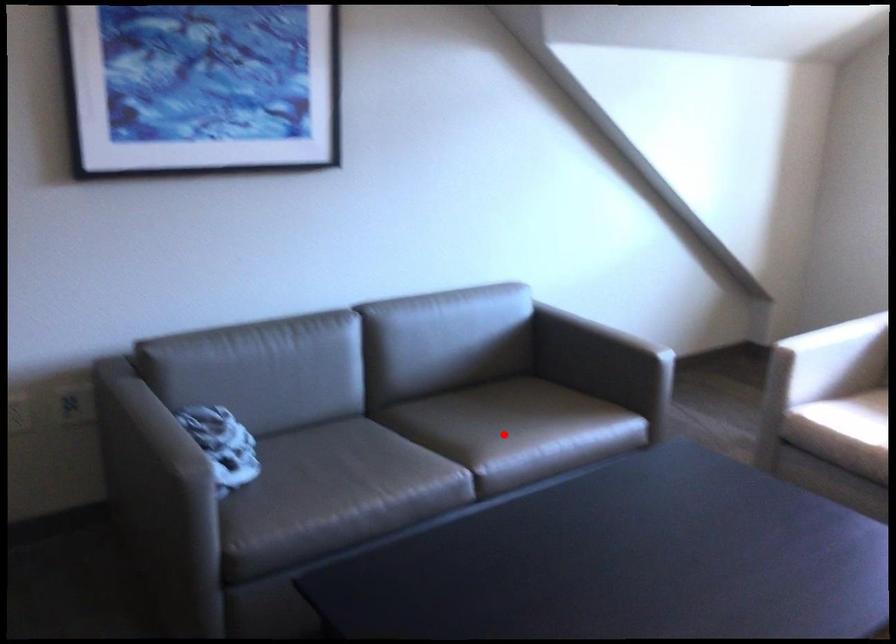
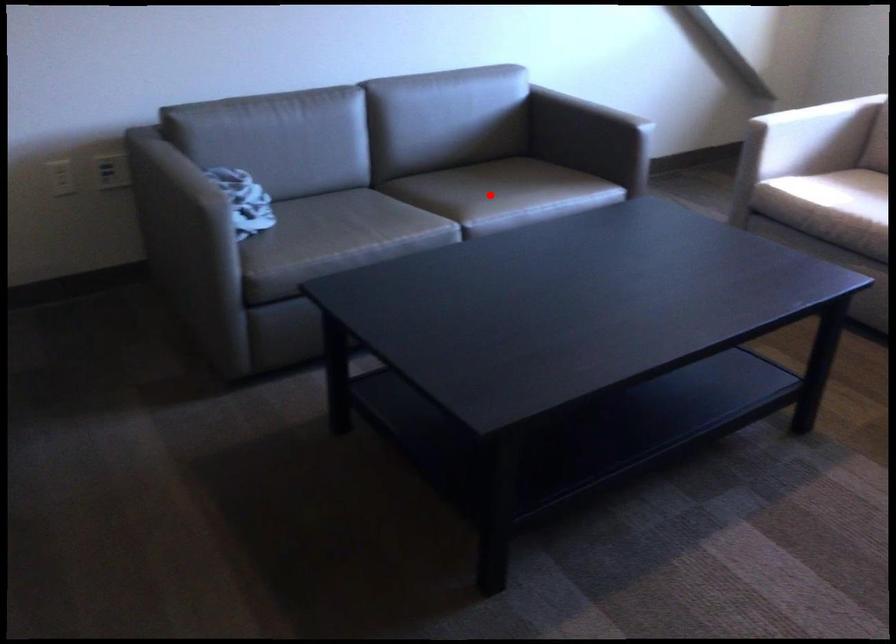
I am providing you with two images of the same scene from different viewpoints. A red point is marked on the first image and another point is marked on the second image. Does the point marked in image1 correspond to the same location as the one in image2?

Yes